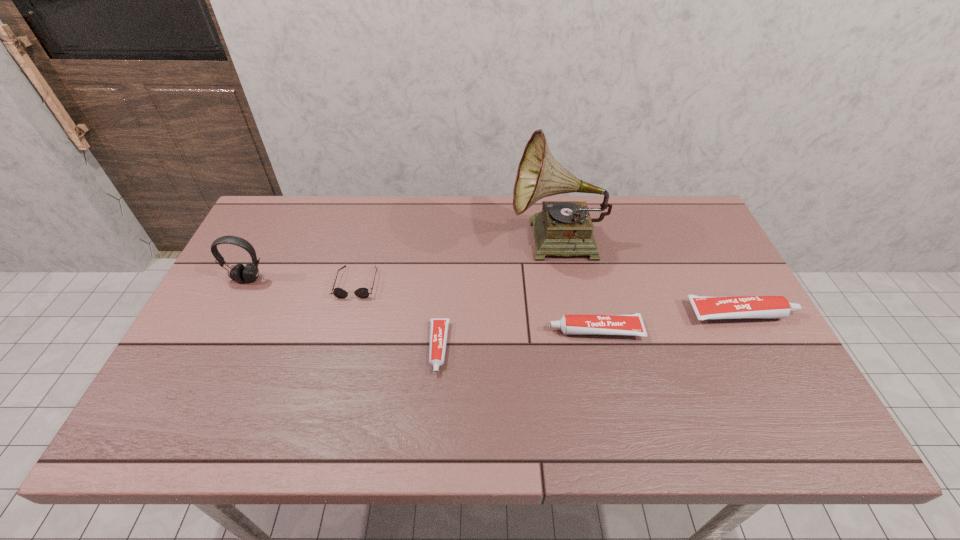
Where is `the shortest toothpaste`? The height and width of the screenshot is (540, 960). the shortest toothpaste is located at coordinates (438, 326).

Where is `the shortest object`? The image size is (960, 540). the shortest object is located at coordinates (438, 326).

At what (x,y) coordinates should I click in order to perform the action: click on the second toothpaste from left to right. Please return your answer as a coordinate pair (x, y). Looking at the image, I should click on (617, 324).

This screenshot has height=540, width=960. Find the location of `the third shortest object`. the third shortest object is located at coordinates (617, 324).

Where is `the rightmost object`? the rightmost object is located at coordinates (705, 307).

Locate an element on the screen. The image size is (960, 540). record player is located at coordinates (565, 228).

This screenshot has height=540, width=960. Find the location of `headset`. headset is located at coordinates (239, 273).

The height and width of the screenshot is (540, 960). I want to click on the second tallest object, so click(239, 273).

This screenshot has height=540, width=960. In order to click on the second object from left to right in this screenshot , I will do `click(362, 293)`.

At what (x,y) coordinates should I click in order to perform the action: click on the fifth tallest object. Please return your answer as a coordinate pair (x, y). Image resolution: width=960 pixels, height=540 pixels. Looking at the image, I should click on (362, 293).